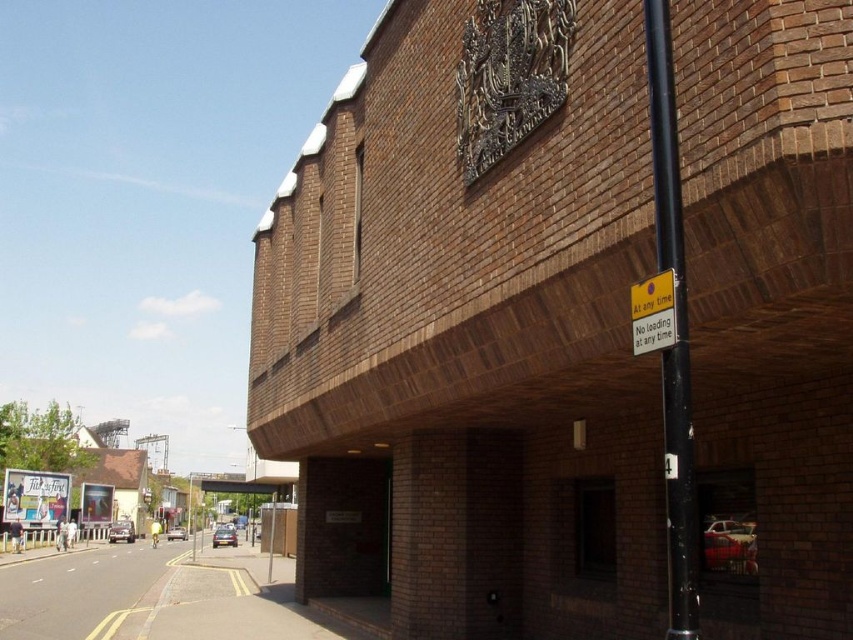
Does black metal pole at right appear over yellow plastic sign at upper right?

Indeed, black metal pole at right is positioned over yellow plastic sign at upper right.

Is black metal pole at right wider than yellow plastic sign at upper right?

Yes, black metal pole at right is wider than yellow plastic sign at upper right.

Identify the location of black metal pole at right. The width and height of the screenshot is (853, 640). (675, 326).

You are a GUI agent. You are given a task and a screenshot of the screen. Output one action in this format:
    pyautogui.click(x=<x>, y=<y>)
    Task: Click on the black metal pole at right
    
    Given the screenshot: What is the action you would take?
    coord(675,326)